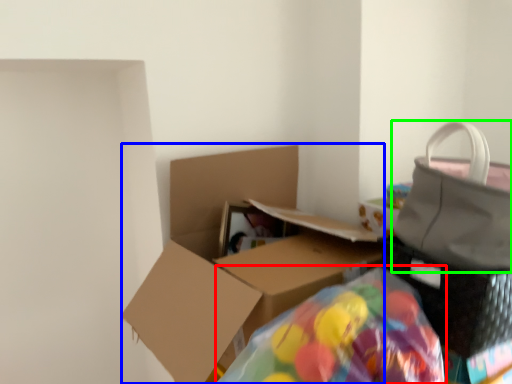
Question: Which object is positioned farthest from bean bag chair (highlighted by a red box)? Select from box (highlighted by a blue box) and handbag (highlighted by a green box).

Choices:
 (A) box
 (B) handbag

Answer: (A)